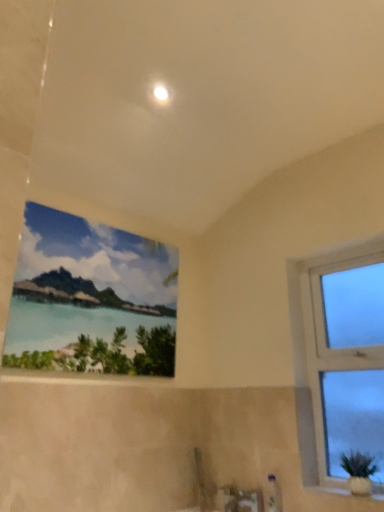
Question: Which direction should I rotate to look at watercolor painting at upper center, the second window viewed from the right?

Choices:
 (A) left
 (B) right

Answer: (A)

Question: From a real-world perspective, does white glossy light at upper center sit lower than watercolor painting at upper center, the 1th window in the left-to-right sequence?

Choices:
 (A) no
 (B) yes

Answer: (A)

Question: Considering the relative sizes of white glossy light at upper center and watercolor painting at upper center, the 1th window in the left-to-right sequence, in the image provided, is white glossy light at upper center thinner than watercolor painting at upper center, the 1th window in the left-to-right sequence,?

Choices:
 (A) yes
 (B) no

Answer: (B)

Question: Does white glossy light at upper center turn towards watercolor painting at upper center, the 1th window in the left-to-right sequence?

Choices:
 (A) yes
 (B) no

Answer: (B)

Question: Is white glossy light at upper center positioned in front of watercolor painting at upper center, the second window viewed from the right?

Choices:
 (A) yes
 (B) no

Answer: (B)

Question: Is white glossy light at upper center facing away from watercolor painting at upper center, the 1th window in the left-to-right sequence?

Choices:
 (A) no
 (B) yes

Answer: (A)

Question: Is white glossy light at upper center outside watercolor painting at upper center, the second window viewed from the right?

Choices:
 (A) yes
 (B) no

Answer: (A)

Question: Considering the relative sizes of white glossy light at upper center and white glossy window sill at lower right in the image provided, is white glossy light at upper center wider than white glossy window sill at lower right?

Choices:
 (A) no
 (B) yes

Answer: (A)

Question: From the image's perspective, does white glossy light at upper center appear higher than white glossy window sill at lower right?

Choices:
 (A) yes
 (B) no

Answer: (A)

Question: From a real-world perspective, does white glossy light at upper center sit lower than white glossy window sill at lower right?

Choices:
 (A) no
 (B) yes

Answer: (A)

Question: Is white glossy light at upper center thinner than white glossy window sill at lower right?

Choices:
 (A) no
 (B) yes

Answer: (B)

Question: Is white glossy window sill at lower right located within white glossy light at upper center?

Choices:
 (A) yes
 (B) no

Answer: (B)

Question: Can you confirm if white glossy light at upper center is shorter than white glossy window sill at lower right?

Choices:
 (A) yes
 (B) no

Answer: (B)

Question: Considering the relative sizes of white glossy window sill at lower right and watercolor painting at upper center, the 1th window in the left-to-right sequence, in the image provided, is white glossy window sill at lower right shorter than watercolor painting at upper center, the 1th window in the left-to-right sequence,?

Choices:
 (A) no
 (B) yes

Answer: (B)